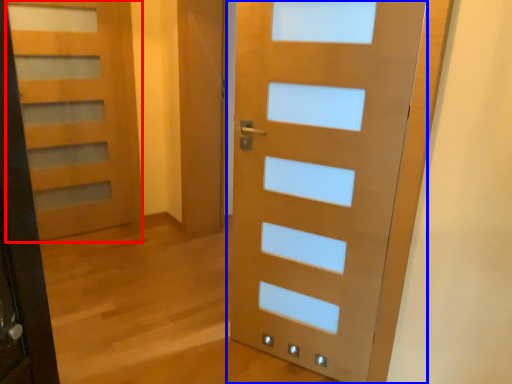
Question: Which object appears closest to the camera in this image, door (highlighted by a red box) or door (highlighted by a blue box)?

Choices:
 (A) door
 (B) door

Answer: (B)